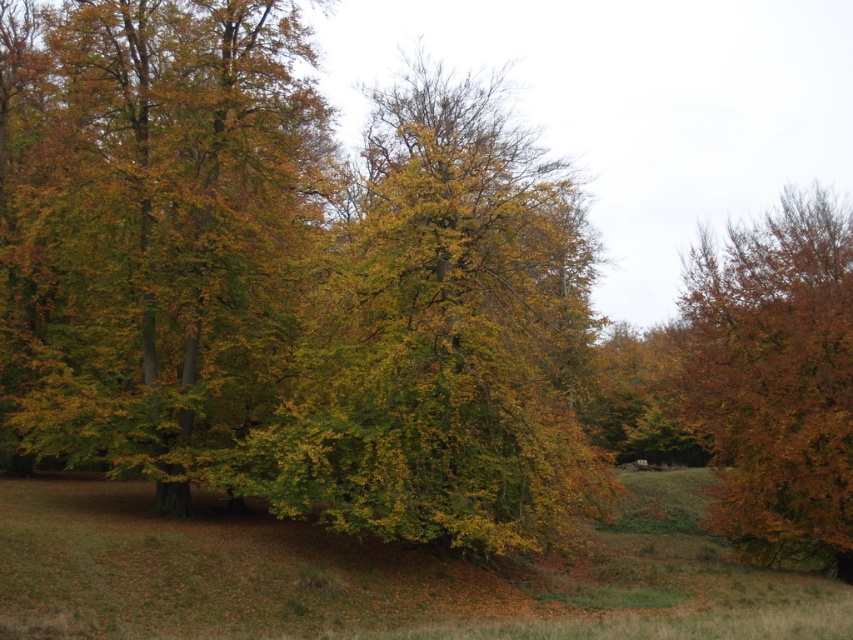
You are standing at the point marked as point (149, 228) in the autumnal landscape. What type of leaves are you currently standing on?

The point (149, 228) is on golden green leaves at center, so you are standing on golden green leaves at center.